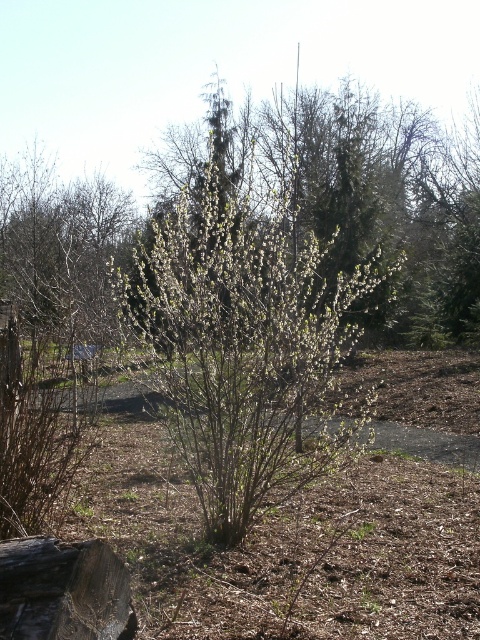
Question: Among these points, which one is nearest to the camera?

Choices:
 (A) (464, 177)
 (B) (9, 568)
 (C) (142, 596)

Answer: (B)

Question: From the image, what is the correct spatial relationship of brown mulch at center in relation to green leafy bush at center?

Choices:
 (A) below
 (B) above

Answer: (A)

Question: Does brown mulch at center lie in front of rough wooden log at lower left?

Choices:
 (A) no
 (B) yes

Answer: (A)

Question: Which object appears closest to the camera in this image?

Choices:
 (A) brown mulch at center
 (B) rough wooden log at lower left

Answer: (B)

Question: Can you confirm if brown mulch at center is positioned to the right of green leafy bush at center?

Choices:
 (A) yes
 (B) no

Answer: (A)

Question: Among these points, which one is nearest to the camera?

Choices:
 (A) (22, 588)
 (B) (352, 376)
 (C) (446, 182)

Answer: (A)